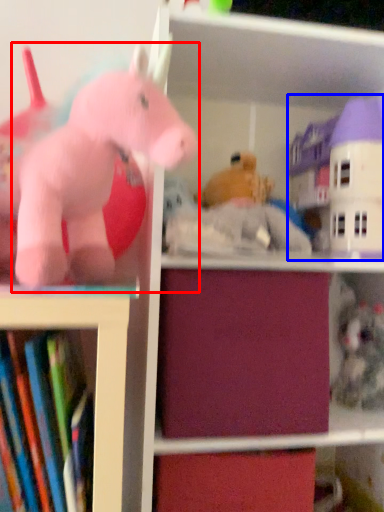
Question: Which object appears farthest to the camera in this image, toy (highlighted by a red box) or toy (highlighted by a blue box)?

Choices:
 (A) toy
 (B) toy

Answer: (B)